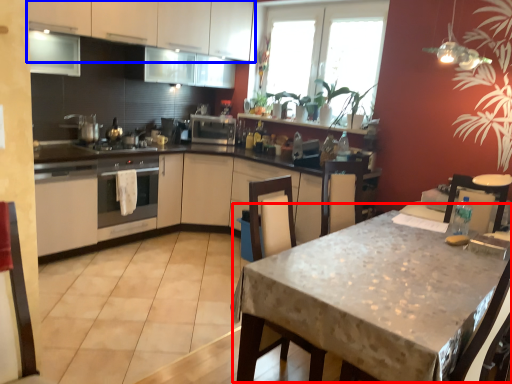
Question: Among these objects, which one is farthest to the camera, round table (highlighted by a red box) or cabinetry (highlighted by a blue box)?

Choices:
 (A) round table
 (B) cabinetry

Answer: (B)